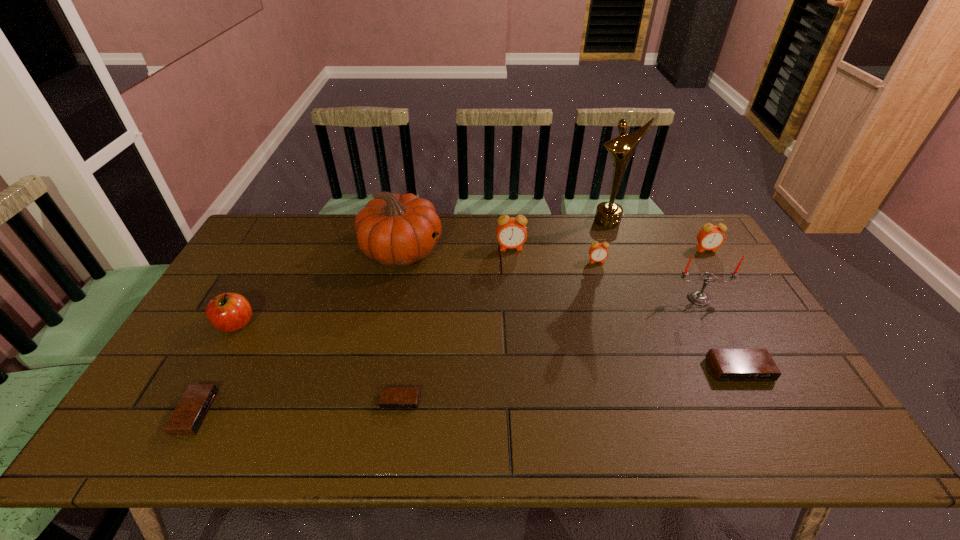
At what (x,y) coordinates should I click in order to perform the action: click on the third farthest alarm clock. Please return your answer as a coordinate pair (x, y). Looking at the image, I should click on (598, 252).

This screenshot has height=540, width=960. Find the location of `the third alarm clock from right to left`. the third alarm clock from right to left is located at coordinates (598, 252).

Find the location of a particular element. This screenshot has width=960, height=540. the third shortest object is located at coordinates (728, 365).

I want to click on the fourth farthest alarm clock, so click(x=728, y=365).

Where is `the leftmost black alarm clock`? The width and height of the screenshot is (960, 540). the leftmost black alarm clock is located at coordinates (189, 414).

Identify the location of the fifth tallest alarm clock. (189, 414).

The width and height of the screenshot is (960, 540). What are the coordinates of `the shortest object` in the screenshot? It's located at click(391, 397).

Where is `the smallest black alarm clock`? The width and height of the screenshot is (960, 540). the smallest black alarm clock is located at coordinates (391, 397).

Where is `free spot located 0.090m on the front-facing side of the award`? The height and width of the screenshot is (540, 960). free spot located 0.090m on the front-facing side of the award is located at coordinates (616, 245).

Where is `vacant space located on the face of the pumpkin`? vacant space located on the face of the pumpkin is located at coordinates (508, 251).